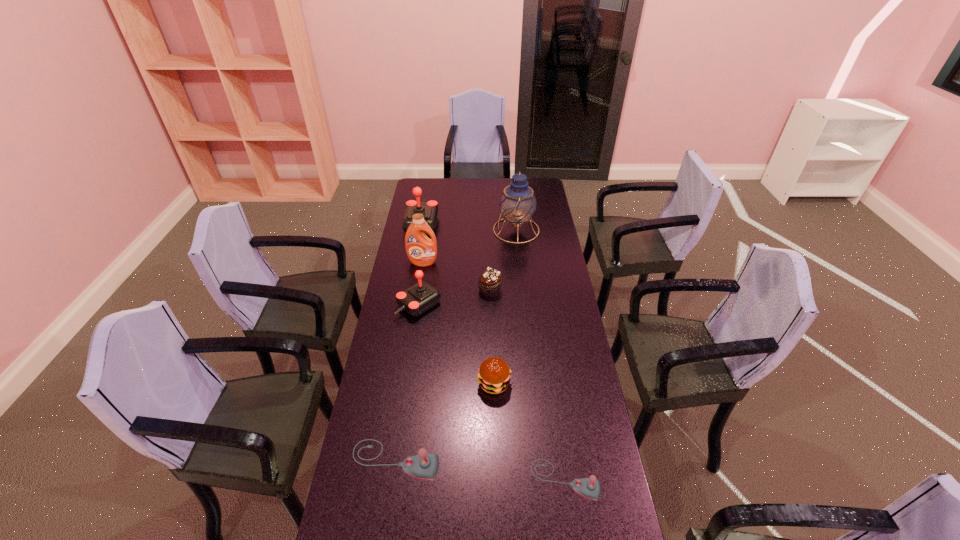
This screenshot has height=540, width=960. I want to click on vacant space that satisfies the following two spatial constraints: 1. on the back side of the bigger gray joystick; 2. on the left side of the second tallest joystick, so click(x=419, y=304).

Locate an element on the screen. This screenshot has width=960, height=540. free region that satisfies the following two spatial constraints: 1. on the front side of the bigger red joystick; 2. on the left side of the shortest joystick is located at coordinates (376, 480).

Identify the location of blank space that satisfies the following two spatial constraints: 1. on the front-facing side of the blue lantern; 2. on the front side of the sixth farthest object. The width and height of the screenshot is (960, 540). (533, 383).